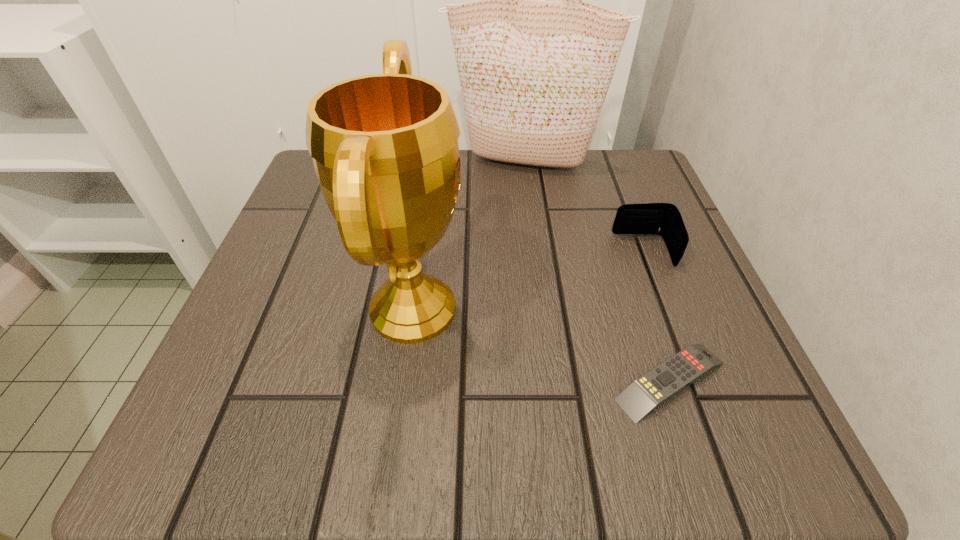
At what (x,y) coordinates should I click in order to perform the action: click on shopping bag. Please return your answer as a coordinate pair (x, y). The width and height of the screenshot is (960, 540). Looking at the image, I should click on 534,75.

Where is `the farthest object`? the farthest object is located at coordinates (534, 75).

Where is `award`? This screenshot has width=960, height=540. award is located at coordinates (385, 150).

Locate an element on the screen. wallet is located at coordinates (664, 219).

This screenshot has height=540, width=960. In order to click on the shortest object in this screenshot , I will do `click(645, 394)`.

Locate an element on the screen. vacant position located 0.170m on the left of the farthest object is located at coordinates click(x=370, y=163).

The width and height of the screenshot is (960, 540). What are the coordinates of `vacant space located on the front-facing side of the third shortest object` in the screenshot? It's located at (588, 309).

The width and height of the screenshot is (960, 540). I want to click on free spot located 0.290m on the outer surface of the wallet, so click(452, 251).

Where is `vacant area situated 0.090m on the outer surface of the wallet`? vacant area situated 0.090m on the outer surface of the wallet is located at coordinates (564, 251).

I want to click on free space located on the outer surface of the wallet, so click(537, 251).